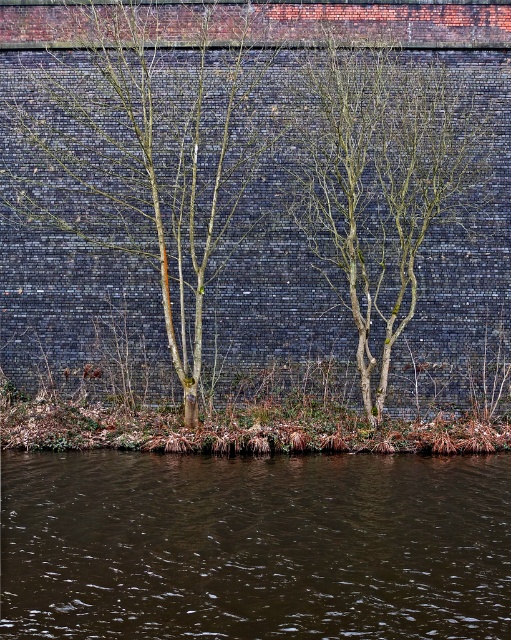
Question: Does brown liquid water at lower center come in front of bare branches at center?

Choices:
 (A) yes
 (B) no

Answer: (A)

Question: Which of these objects is positioned farthest from the bare branches at center?

Choices:
 (A) brown liquid water at lower center
 (B) bare wood tree at center

Answer: (A)

Question: Which of these objects is positioned farthest from the bare wood tree at center?

Choices:
 (A) bare branches at center
 (B) brown liquid water at lower center

Answer: (B)

Question: Can you confirm if brown liquid water at lower center is positioned above bare wood tree at center?

Choices:
 (A) yes
 (B) no

Answer: (B)

Question: Which point is closer to the camera?

Choices:
 (A) brown liquid water at lower center
 (B) bare wood tree at center

Answer: (A)

Question: Can you confirm if brown liquid water at lower center is positioned above bare branches at center?

Choices:
 (A) yes
 (B) no

Answer: (B)